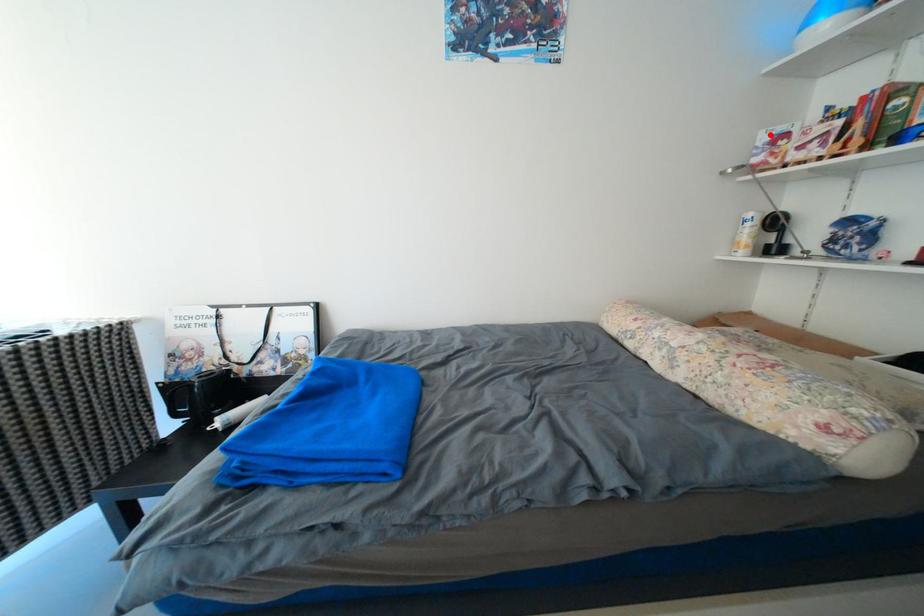
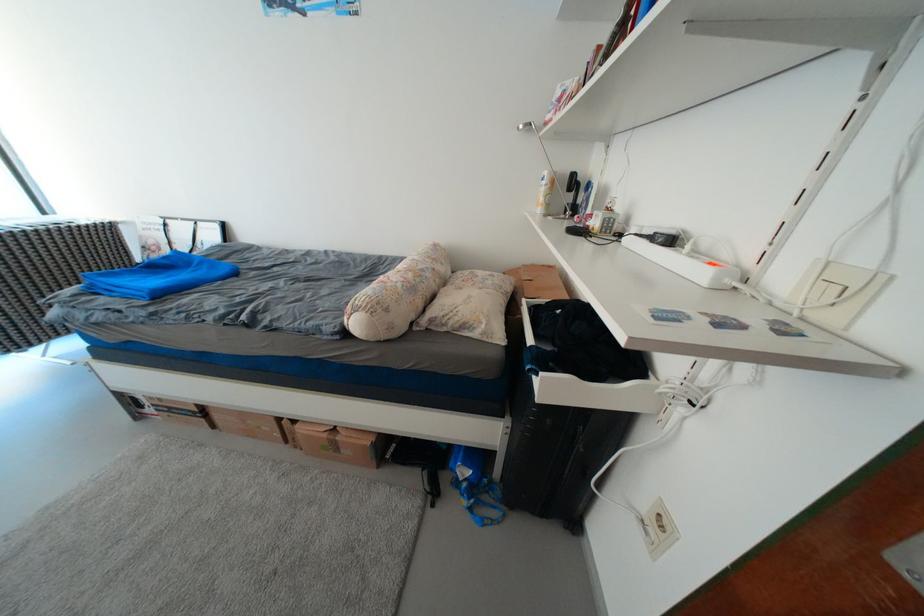
The point at the highlighted location is marked in the first image. Where is the corresponding point in the second image?

(567, 89)